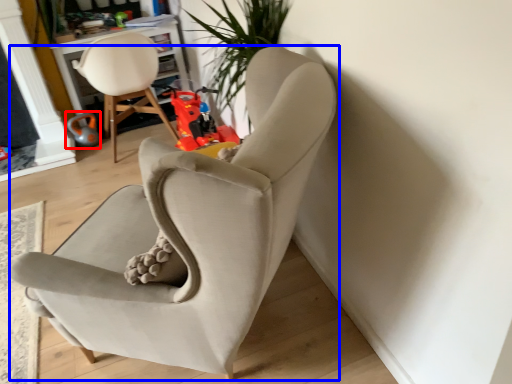
Question: Which point is further to the camera, toy (highlighted by a red box) or chair (highlighted by a blue box)?

Choices:
 (A) toy
 (B) chair

Answer: (A)